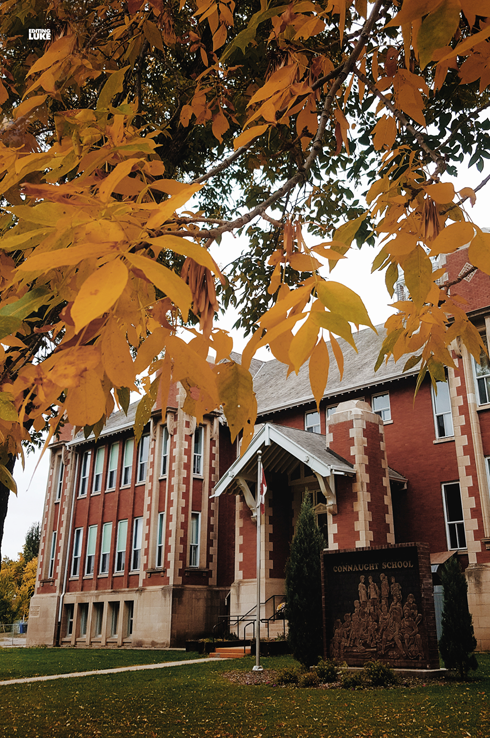
Where is `pillar`? pillar is located at coordinates (375, 522), (246, 525).